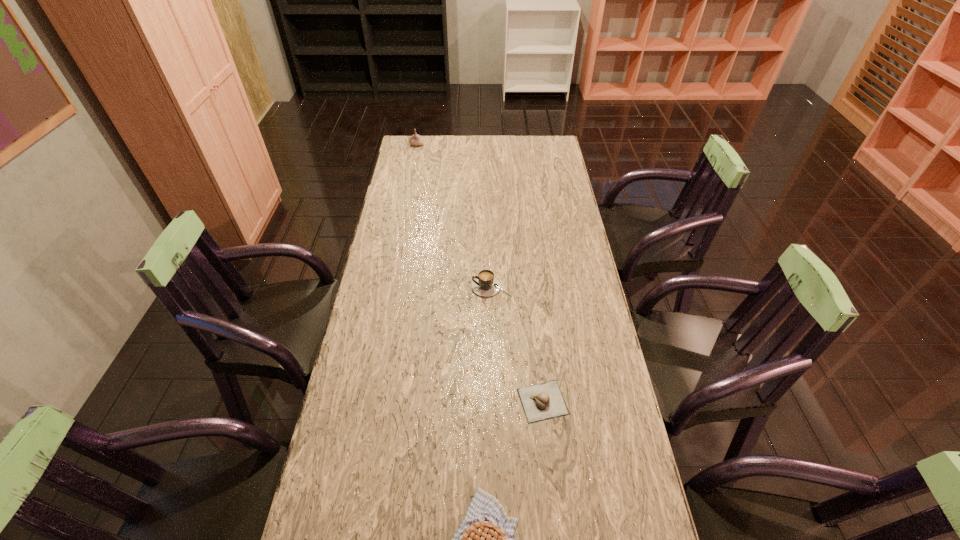
Identify the location of free point between the second tallest object and the shortest object. (517, 344).

This screenshot has height=540, width=960. Identify the location of vacant space that is in between the third nearest object and the shortest object. (517, 344).

The height and width of the screenshot is (540, 960). Find the location of `free space between the right garlic and the second tallest object`. free space between the right garlic and the second tallest object is located at coordinates (517, 344).

Locate an element on the screen. The image size is (960, 540). empty space between the third shortest object and the nearer garlic is located at coordinates (517, 344).

Select which object appears as the closest to the nearer garlic. Please provide its 2D coordinates. Your answer should be formatted as a tuple, i.e. [(x, y)], where the tuple contains the x and y coordinates of a point satisfying the conditions above.

[(485, 539)]

Select which object appears as the closest to the third nearest object. Please provide its 2D coordinates. Your answer should be formatted as a tuple, i.e. [(x, y)], where the tuple contains the x and y coordinates of a point satisfying the conditions above.

[(544, 401)]

Where is `free location that satisfies the following two spatial constraints: 1. with the handle on the side of the shortest object; 2. on the left side of the second farthest object`? free location that satisfies the following two spatial constraints: 1. with the handle on the side of the shortest object; 2. on the left side of the second farthest object is located at coordinates click(494, 402).